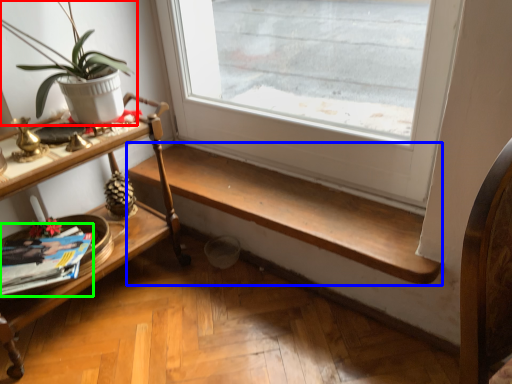
Question: Which object is the farthest from houseplant (highlighted by a red box)? Choose among these: stairwell (highlighted by a blue box) or magazine (highlighted by a green box).

Choices:
 (A) stairwell
 (B) magazine

Answer: (A)